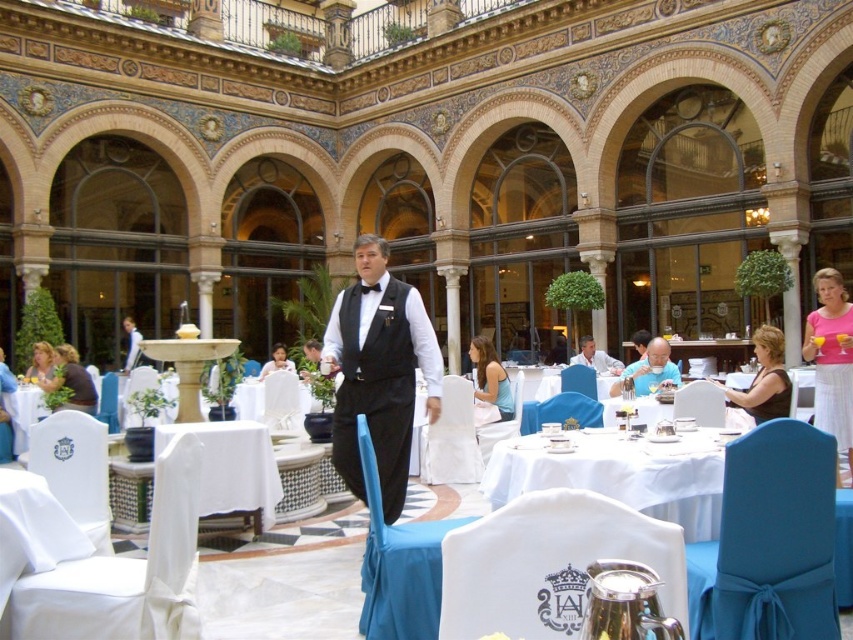
Question: Based on their relative distances, which object is nearer to the pink fabric dress at right?

Choices:
 (A) blonde hair at lower left
 (B) white cloth at center
 (C) white fabric table at center

Answer: (B)

Question: Can you confirm if white cloth at center is bigger than matte black shirt at center?

Choices:
 (A) no
 (B) yes

Answer: (A)

Question: Is white cloth at center smaller than white fabric shirt at center?

Choices:
 (A) yes
 (B) no

Answer: (A)

Question: Which point appears closest to the camera in this image?

Choices:
 (A) (582, 352)
 (B) (42, 381)

Answer: (B)

Question: Considering the relative positions of black satin vest at center and pink fabric dress at right in the image provided, where is black satin vest at center located with respect to pink fabric dress at right?

Choices:
 (A) left
 (B) right

Answer: (A)

Question: Which of the following is the closest to the observer?

Choices:
 (A) (657, 358)
 (B) (378, 248)
 (C) (207, 474)
 (D) (505, 392)

Answer: (C)